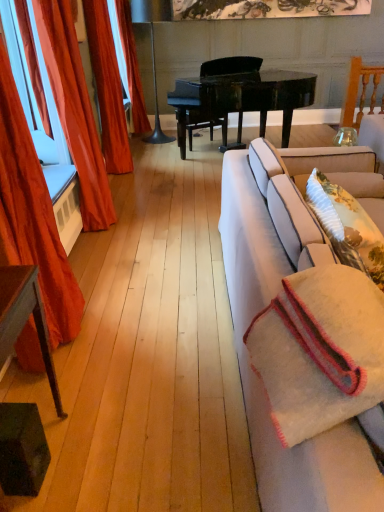
Image resolution: width=384 pixels, height=512 pixels. Identify the location of free space to the back side of velvet orange curtain at left, which is the 1th curtain from front to back. (103, 282).